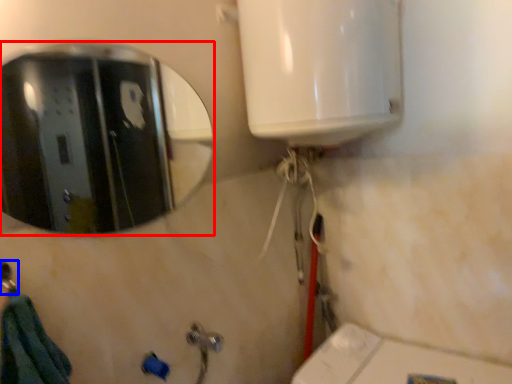
Question: Which object appears closest to the camera in this image, mirror (highlighted by a red box) or shower (highlighted by a blue box)?

Choices:
 (A) mirror
 (B) shower

Answer: (B)